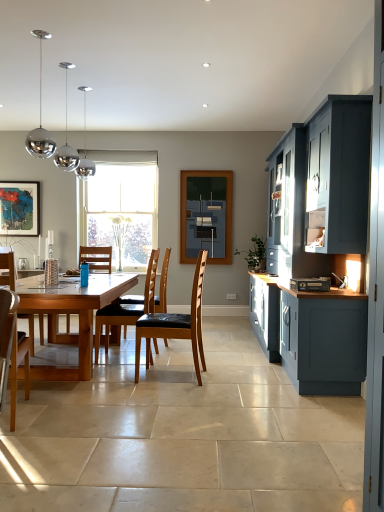
Question: From a real-world perspective, is natural wood table at center physically above matte black painting at center?

Choices:
 (A) no
 (B) yes

Answer: (A)

Question: Is natural wood table at center beside matte black painting at center?

Choices:
 (A) yes
 (B) no

Answer: (B)

Question: Can you confirm if natural wood table at center is shorter than matte black painting at center?

Choices:
 (A) yes
 (B) no

Answer: (A)

Question: Is natural wood table at center taller than matte black painting at center?

Choices:
 (A) yes
 (B) no

Answer: (B)

Question: Can you confirm if natural wood table at center is thinner than matte black painting at center?

Choices:
 (A) no
 (B) yes

Answer: (A)

Question: Considering their positions, is brown leather chair at center, the second chair from the right, located in front of or behind brown leather chair at center?

Choices:
 (A) behind
 (B) front

Answer: (B)

Question: Considering the positions of point (125, 306) and point (125, 329), is point (125, 306) closer or farther from the camera than point (125, 329)?

Choices:
 (A) closer
 (B) farther

Answer: (A)

Question: Is brown leather chair at center, the second chair from the right, inside or outside of brown leather chair at center?

Choices:
 (A) inside
 (B) outside

Answer: (B)

Question: From a real-world perspective, relative to brown leather chair at center, is brown leather chair at center, acting as the first chair starting from the back, vertically above or below?

Choices:
 (A) above
 (B) below

Answer: (B)

Question: Is point (160, 272) positioned closer to the camera than point (173, 335)?

Choices:
 (A) farther
 (B) closer

Answer: (A)

Question: From the image's perspective, relative to natural wood table at center, is brown leather chair at center above or below?

Choices:
 (A) above
 (B) below

Answer: (A)

Question: In terms of width, does brown leather chair at center look wider or thinner when compared to natural wood table at center?

Choices:
 (A) thin
 (B) wide

Answer: (A)

Question: Is brown leather chair at center to the left or to the right of natural wood table at center in the image?

Choices:
 (A) right
 (B) left

Answer: (A)

Question: Relative to black plastic dvd player at right, is brown leather chair at center in front or behind?

Choices:
 (A) behind
 (B) front

Answer: (A)

Question: Is point (163, 266) positioned closer to the camera than point (311, 282)?

Choices:
 (A) farther
 (B) closer

Answer: (A)